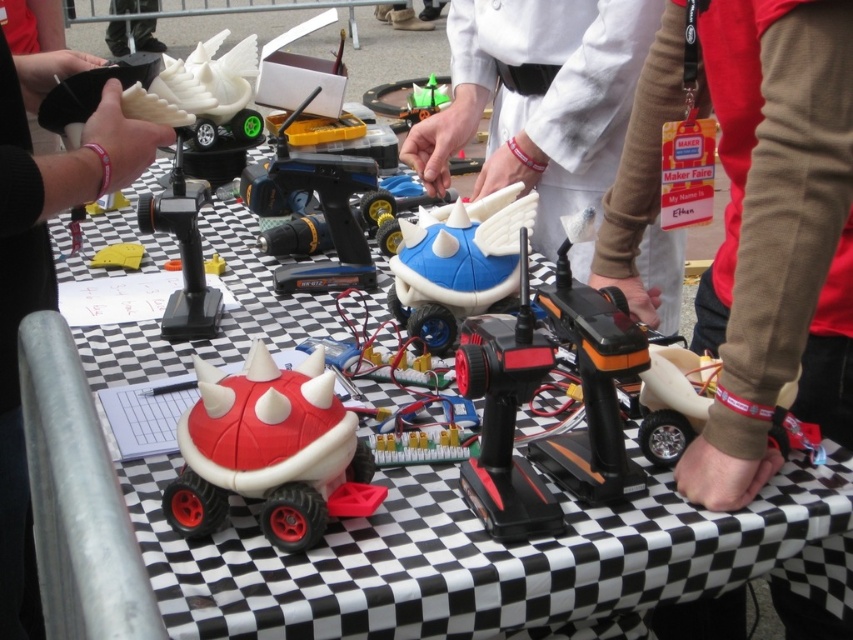
Question: Does rubberized red toy car at center have a greater width compared to green matte toy at center?

Choices:
 (A) no
 (B) yes

Answer: (B)

Question: Considering the real-world distances, which object is farthest from the matte black glove at upper left?

Choices:
 (A) rubberized red toy car at center
 (B) green matte toy at center
 (C) blue matte toy at center

Answer: (B)

Question: Which object is positioned farthest from the rubberized red toy car at center?

Choices:
 (A) blue matte toy at center
 (B) green matte toy at center

Answer: (B)

Question: Which of the following is the farthest from the observer?

Choices:
 (A) (39, 602)
 (B) (326, 390)
 (C) (416, 100)
 (D) (511, 8)

Answer: (C)

Question: Does white matte toy at center appear on the left side of rubberized red toy car at center?

Choices:
 (A) yes
 (B) no

Answer: (B)

Question: Observing the image, what is the correct spatial positioning of white matte toy at center in reference to green matte toy at center?

Choices:
 (A) right
 (B) left

Answer: (A)